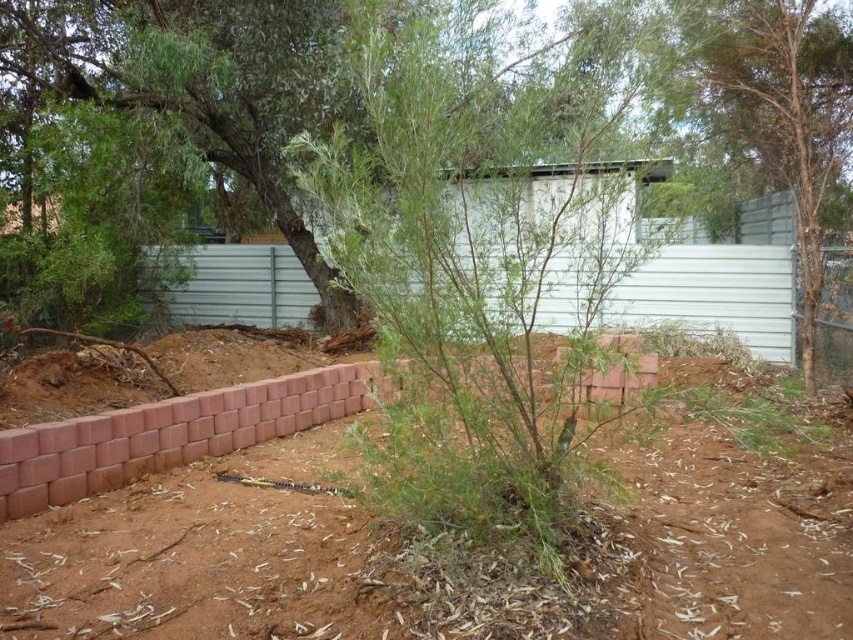
Based on the photo, you are standing at the point labeled as point (782,108) in the image. What is the nearest object to you?

The nearest object to you is the green leafy tree at center since the point is located on it.

You are standing in front of the partially constructed brick retaining wall and see two points marked in the scene. Which point, point (328,80) or point (834,132), is closer to you?

Point (328,80) is closer to the viewer than point (834,132).

You are a gardener who wants to plant a new shrub between the green leafy bush at center and the green leafy tree at center. Which one should you place the shrub closer to if you want it to grow taller than the other?

The green leafy bush at center is taller than the green leafy tree at center. To ensure the new shrub grows taller than the other, place it closer to the green leafy bush at center.